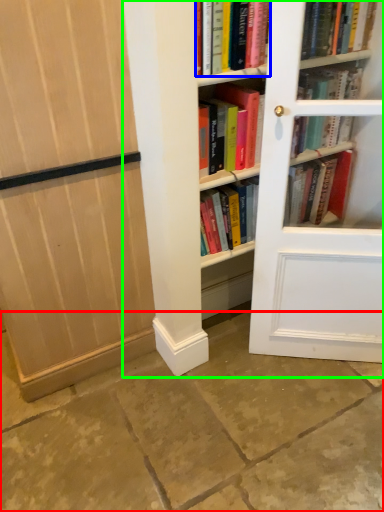
Question: Based on their relative distances, which object is nearer to concrete (highlighted by a red box)? Choose from book (highlighted by a blue box) and bookcase (highlighted by a green box).

Choices:
 (A) book
 (B) bookcase

Answer: (B)